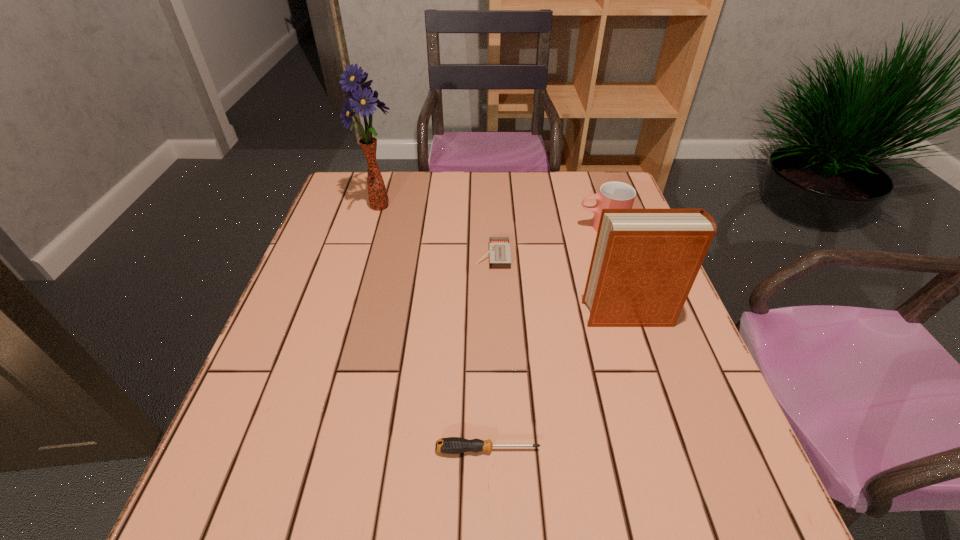
Find the location of a particular element. The width and height of the screenshot is (960, 540). hardback book that is at the right edge is located at coordinates (644, 263).

Find the location of `cup at the right edge`. cup at the right edge is located at coordinates (612, 195).

Where is `object situated at the far left corner`? The height and width of the screenshot is (540, 960). object situated at the far left corner is located at coordinates (363, 99).

This screenshot has height=540, width=960. I want to click on vacant space at the far edge, so click(465, 189).

Identify the location of free location at the near edge. Image resolution: width=960 pixels, height=540 pixels. (609, 509).

Find the location of a particular element. blank space at the left edge of the desktop is located at coordinates (339, 259).

Identify the location of free space at the right edge. [697, 374].

Find the location of a particular element. This screenshot has height=540, width=960. vacant space at the near left corner of the desktop is located at coordinates (205, 522).

At what (x,y) coordinates should I click in order to perform the action: click on vacant space at the near right corner of the desktop. Please return your answer as a coordinate pair (x, y). Looking at the image, I should click on (688, 536).

Locate an element on the screen. Image resolution: width=960 pixels, height=540 pixels. empty space between the leftmost object and the nearest object is located at coordinates (434, 328).